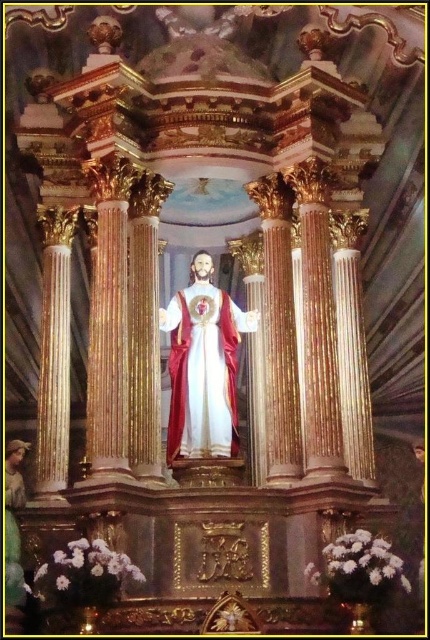
Who is more distant from viewer, (190, 346) or (11, 486)?

The point (190, 346) is behind.

You are a GUI agent. You are given a task and a screenshot of the screen. Output one action in this format:
    pyautogui.click(x=<x>, y=<y>)
    Task: Click on the white satin statue at center
    The image size is (430, 640).
    Given the screenshot: What is the action you would take?
    pyautogui.click(x=203, y=365)

Is point (208, 438) closer to viewer compared to point (11, 497)?

That is False.

Where is `white satin statue at center`? white satin statue at center is located at coordinates (203, 365).